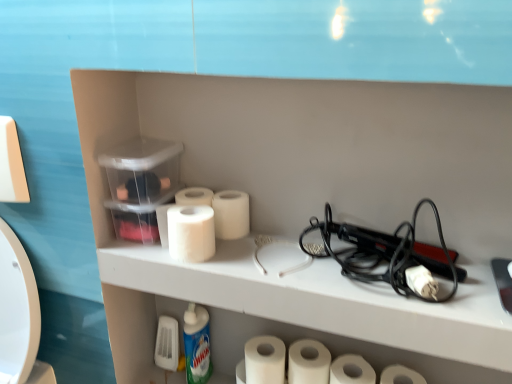
You are a GUI agent. You are given a task and a screenshot of the screen. Output one action in this format:
    pyautogui.click(x=<x>, y=<y>)
    Task: Click on the blank area to the left of black plastic hair straightener at right
    This screenshot has width=512, height=384.
    Given the screenshot: What is the action you would take?
    pyautogui.click(x=265, y=259)